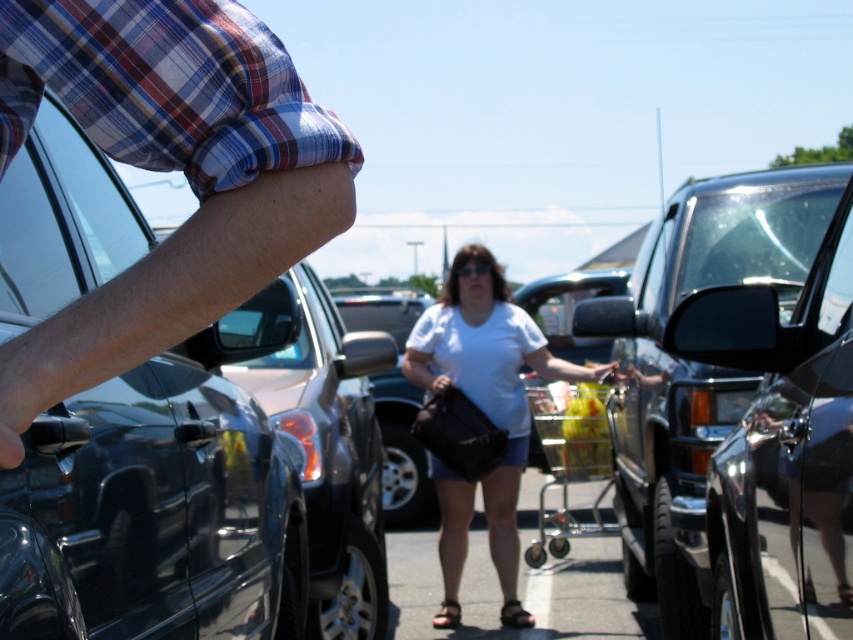
You are a security camera in the parking lot. You observe the plaid fabric sleeve at upper left and the white matte shirt at center. Which object is closer to you?

The plaid fabric sleeve at upper left is closer to you because it is in front of the white matte shirt at center.

You are a photographer trying to capture a clear shot of the glossy black car at center and the white matte shirt at center. Which object should you focus on first to ensure both are in focus?

The glossy black car at center is closer to the viewer than the white matte shirt at center, so you should focus on the glossy black car at center first to ensure both are in focus.

Looking at this image, based on the scene description, where is the plaid fabric sleeve at upper left located in terms of its 2D coordinates?

The plaid fabric sleeve at upper left is located at the 2D coordinates of point (167, 170).